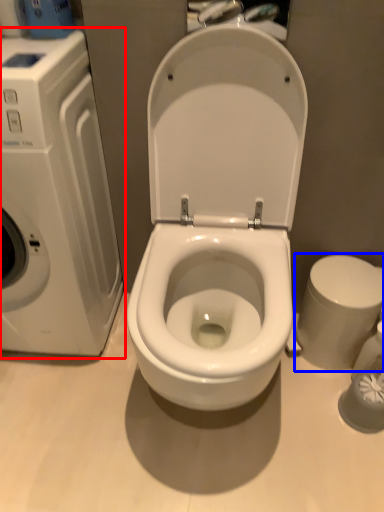
Question: Which of the following is the farthest to the observer, washing machine (highlighted by a red box) or bidet (highlighted by a blue box)?

Choices:
 (A) washing machine
 (B) bidet

Answer: (B)